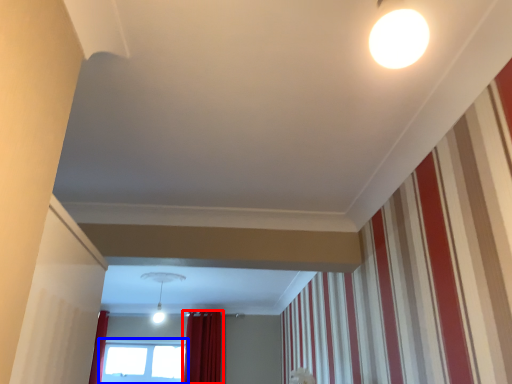
Question: Which of the following is the farthest to the observer, curtain (highlighted by a red box) or window (highlighted by a blue box)?

Choices:
 (A) curtain
 (B) window

Answer: (B)